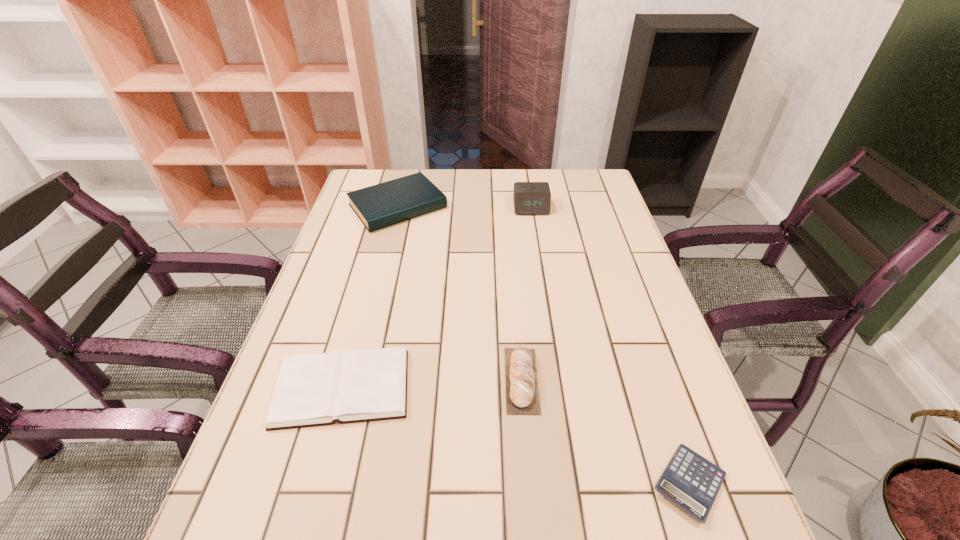
Where is `alarm clock`? alarm clock is located at coordinates coord(530,198).

Find the location of a particular element. This screenshot has height=540, width=960. the farther hardback book is located at coordinates (388, 203).

I want to click on pita bread, so click(522, 392).

Find the location of `the shorter hardback book`. the shorter hardback book is located at coordinates (360, 385).

You are a GUI agent. You are given a task and a screenshot of the screen. Output one action in this format:
    pyautogui.click(x=<x>, y=<y>)
    Task: Click on the fourth tallest object
    The width and height of the screenshot is (960, 540).
    Given the screenshot: What is the action you would take?
    coord(360,385)

Where is `the shortest object`? The width and height of the screenshot is (960, 540). the shortest object is located at coordinates click(690, 481).

This screenshot has height=540, width=960. Identify the location of calculator. coord(690,481).

Where is `free space located 0.170m on the front-facing side of the tallest object`? free space located 0.170m on the front-facing side of the tallest object is located at coordinates (538, 250).

You are a GUI agent. You are given a task and a screenshot of the screen. Output one action in this format:
    pyautogui.click(x=<x>, y=<y>)
    Task: Click on the free spot located 0.130m on the right of the taller hardback book
    The width and height of the screenshot is (960, 540).
    Given the screenshot: What is the action you would take?
    pyautogui.click(x=489, y=206)

Identify the location of vacant space situated 0.190m on the back of the pita bread. Image resolution: width=960 pixels, height=540 pixels. (515, 290).